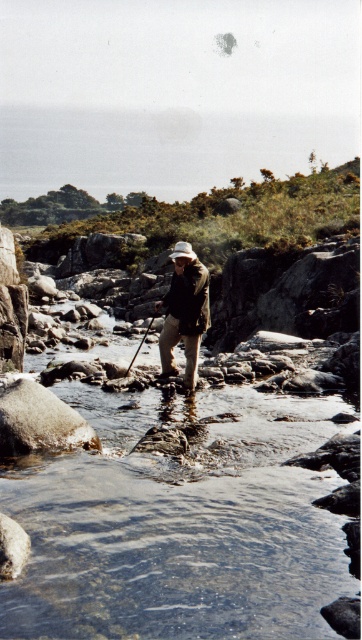
You are the hiker in the image and want to cross the stream safely. There are two points marked on the stream bed. The first is at point (167, 461) and the second at point (137, 346). Which point should you step on first to move forward in the direction you are facing?

You should step on point (167, 461) first because it is in front of point (137, 346), so stepping on it first will allow you to move forward in the direction you are facing.